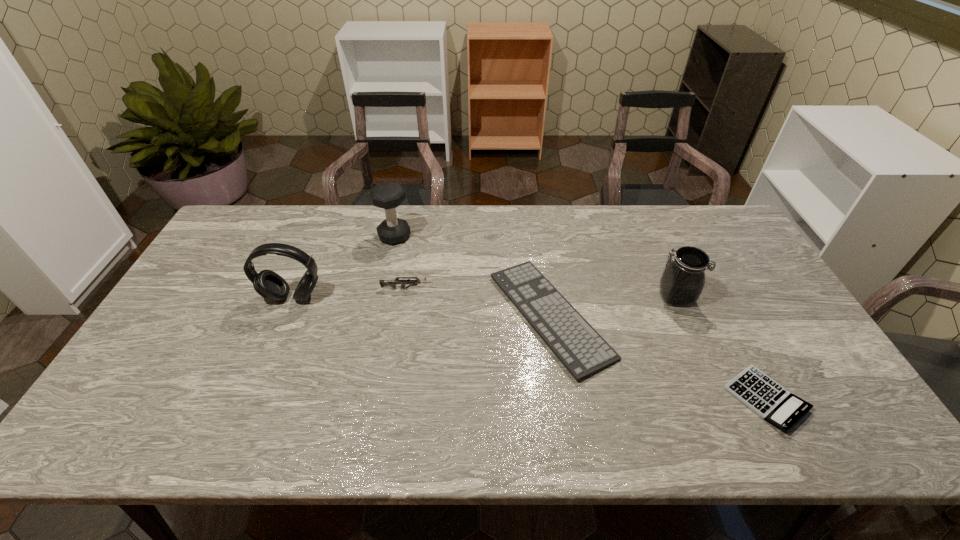
Identify the location of vacant area in the image that satisfies the following two spatial constraints: 1. aimed along the barrel of the fourth tallest object; 2. on the earcups of the leftmost object. Image resolution: width=960 pixels, height=540 pixels. (406, 298).

Identify the location of blank area in the image that satisfies the following two spatial constraints: 1. aimed along the barrel of the gun; 2. on the left side of the fourth object from left to right. (403, 315).

Where is `vacant area that satisfies the following two spatial constraints: 1. aimed along the barrel of the gun; 2. on the left side of the fourth object from left to right`? The image size is (960, 540). vacant area that satisfies the following two spatial constraints: 1. aimed along the barrel of the gun; 2. on the left side of the fourth object from left to right is located at coordinates (403, 315).

Find the location of `free space that satisfies the following two spatial constraints: 1. on the lid of the calculator; 2. on the right side of the jar`. free space that satisfies the following two spatial constraints: 1. on the lid of the calculator; 2. on the right side of the jar is located at coordinates (720, 399).

You are a GUI agent. You are given a task and a screenshot of the screen. Output one action in this format:
    pyautogui.click(x=<x>, y=<y>)
    Task: Click on the vacant area that satisfies the following two spatial constraints: 1. on the front side of the third object from right to left; 2. on the right side of the shortest object
    This screenshot has height=540, width=960.
    Given the screenshot: What is the action you would take?
    pyautogui.click(x=563, y=399)

Where is `vacant point that satisfies the following two spatial constraints: 1. on the lid of the jar; 2. on the right side of the calculator`? Image resolution: width=960 pixels, height=540 pixels. vacant point that satisfies the following two spatial constraints: 1. on the lid of the jar; 2. on the right side of the calculator is located at coordinates (720, 399).